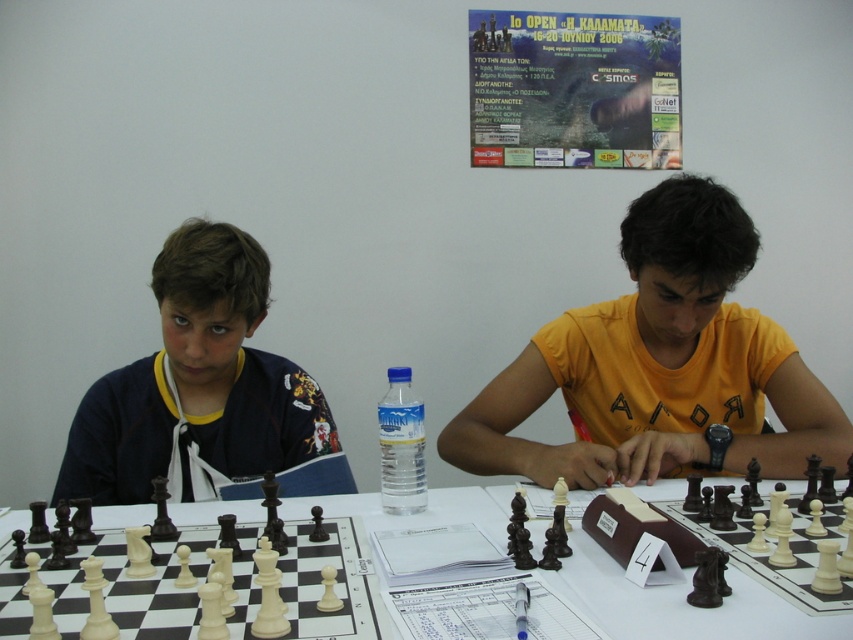
How far apart are dark blue fabric shirt at left and paper poster at upper center?

dark blue fabric shirt at left is 1.51 meters away from paper poster at upper center.

Can you confirm if dark blue fabric shirt at left is positioned to the left of paper poster at upper center?

Correct, you'll find dark blue fabric shirt at left to the left of paper poster at upper center.

Describe the element at coordinates (196, 387) in the screenshot. I see `dark blue fabric shirt at left` at that location.

Identify the location of dark blue fabric shirt at left. (196, 387).

Between point (149, 476) and point (751, 593), which one is positioned in front?

Point (751, 593)

Is dark blue fabric shirt at left below white plastic table at center?

No.

Is point (305, 422) more distant than point (602, 548)?

Yes, point (305, 422) is behind point (602, 548).

Find the location of `dark blue fabric shirt at left`. dark blue fabric shirt at left is located at coordinates (196, 387).

The height and width of the screenshot is (640, 853). I want to click on orange cotton shirt at center, so click(659, 364).